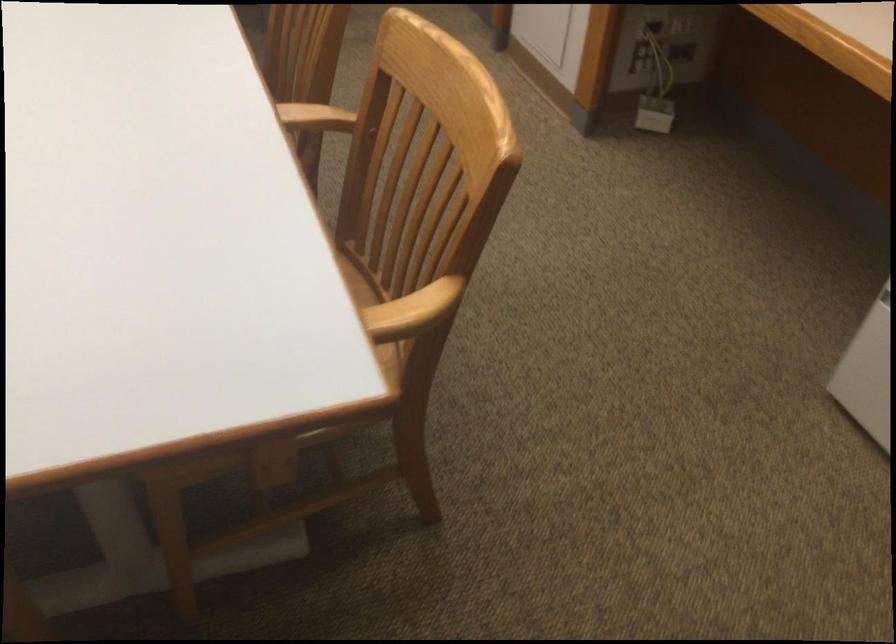
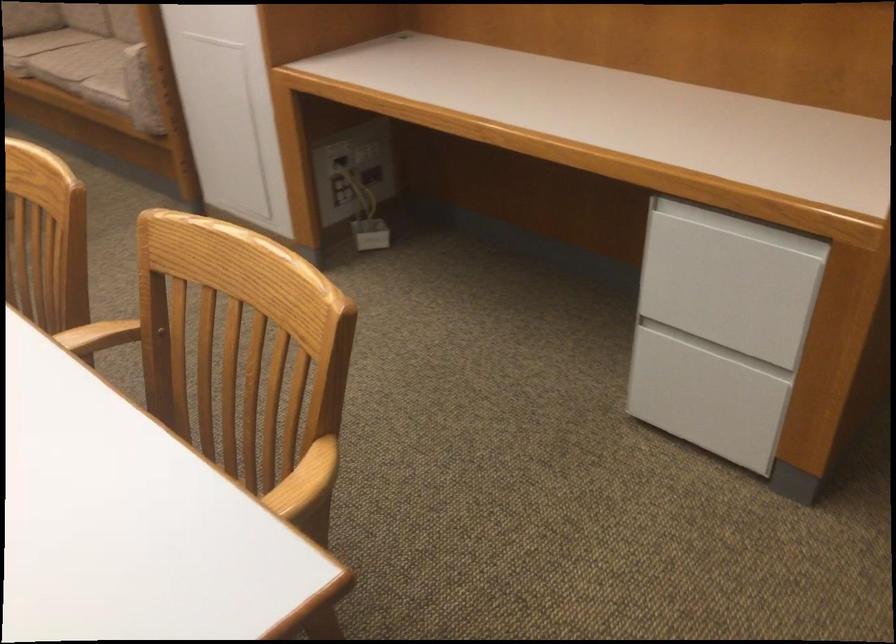
The point at (416, 305) is marked in the first image. Where is the corresponding point in the second image?

(304, 482)